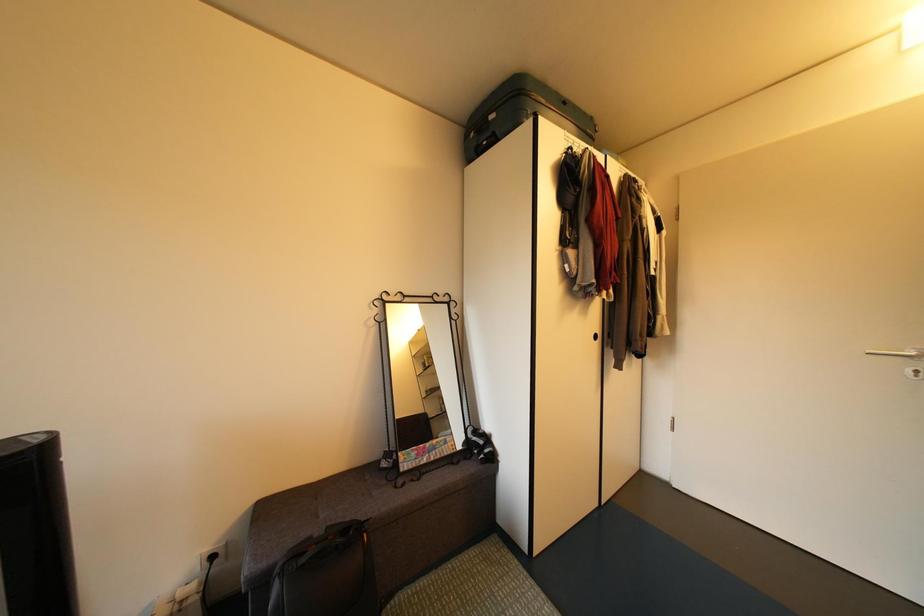
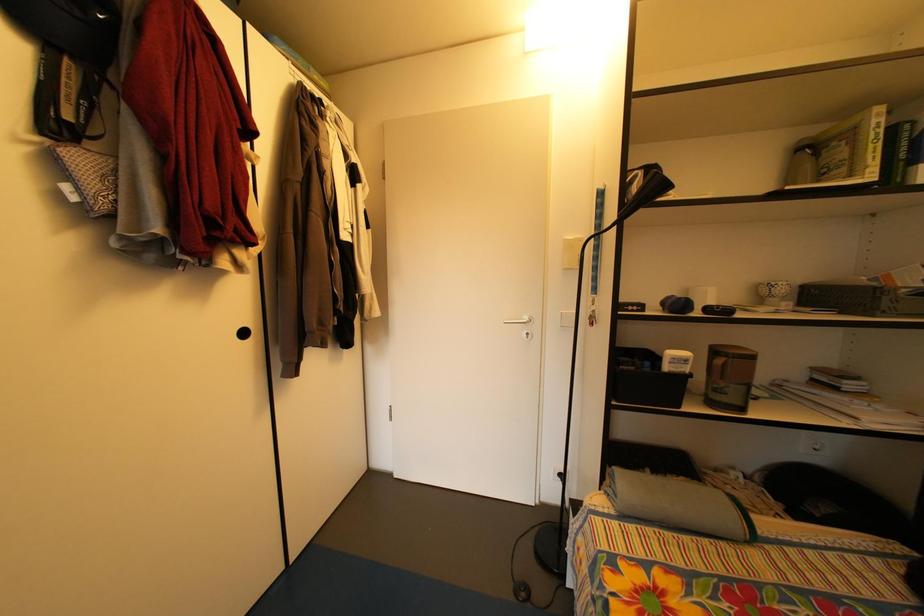
Question: How did the camera likely rotate?

Choices:
 (A) Left
 (B) Right
 (C) Up
 (D) Down

Answer: (B)